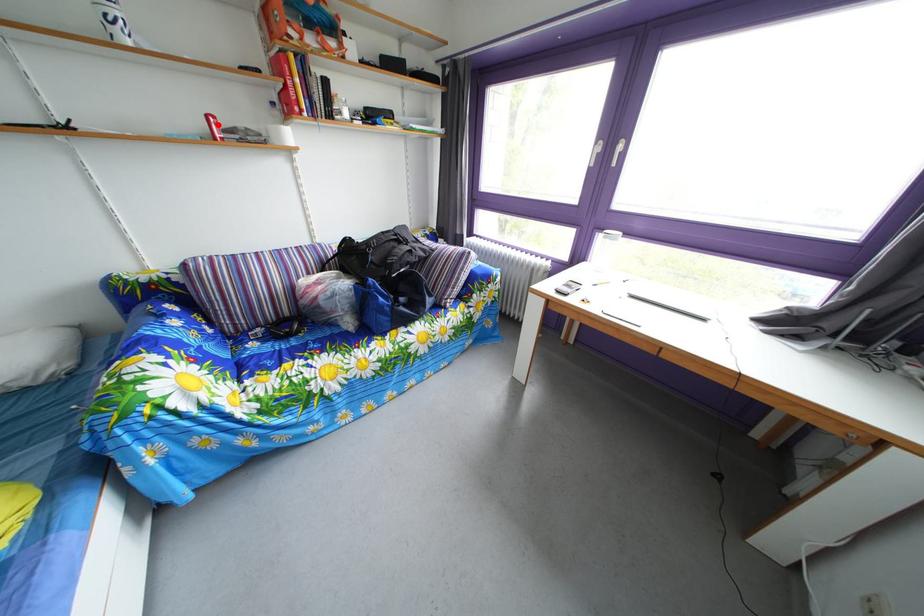
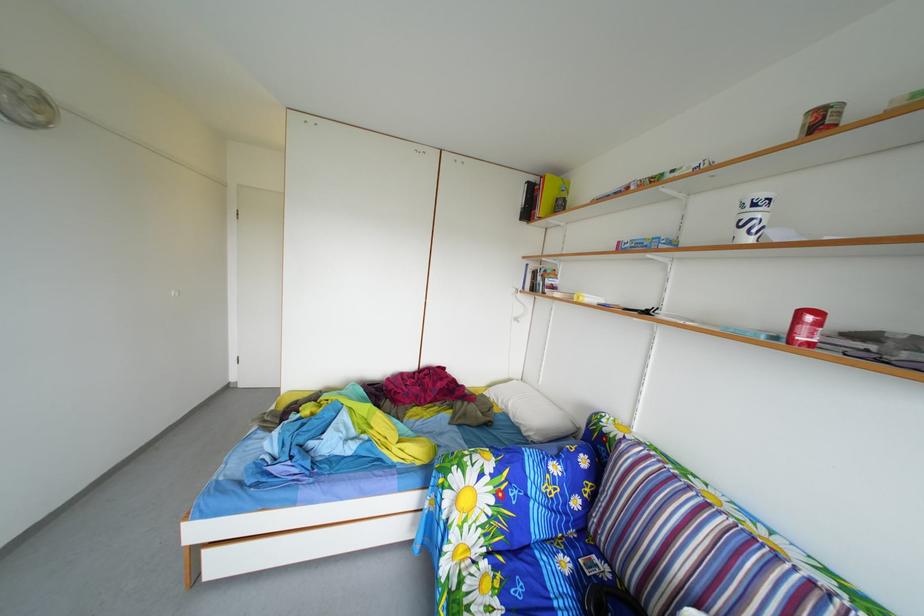
Find the pixel in the second image that matches the highlighted location in the first image.

(811, 321)